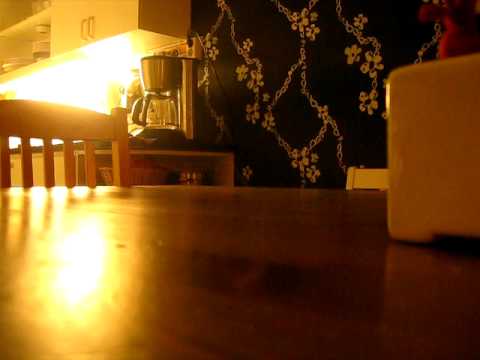
Find the location of a particular element. light is located at coordinates (68, 62).